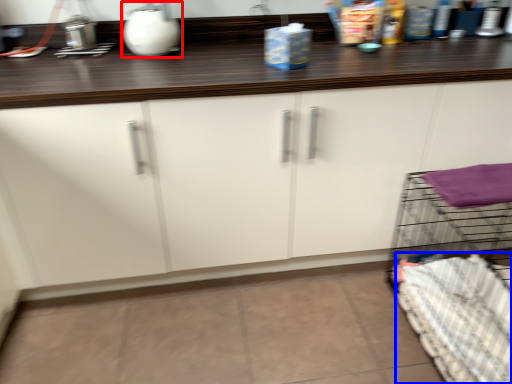
Question: Which point is further to the camera, appliance (highlighted by a red box) or bedding (highlighted by a blue box)?

Choices:
 (A) appliance
 (B) bedding

Answer: (A)